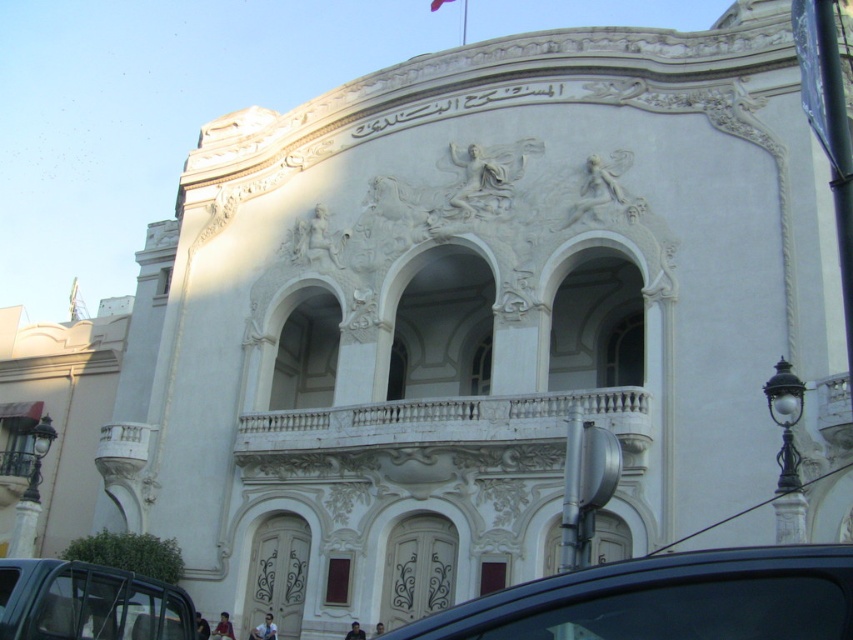
Question: Which point appears farthest from the camera in this image?

Choices:
 (A) (430, 3)
 (B) (527, 611)

Answer: (A)

Question: Which of the following is the closest to the observer?

Choices:
 (A) (430, 3)
 (B) (180, 618)

Answer: (B)

Question: Is the position of metallic gray car at lower left less distant than that of white fabric flag at upper center?

Choices:
 (A) yes
 (B) no

Answer: (A)

Question: Is black glossy car at lower center positioned in front of metallic gray car at lower left?

Choices:
 (A) no
 (B) yes

Answer: (B)

Question: Which object appears farthest from the camera in this image?

Choices:
 (A) black glossy car at lower center
 (B) white fabric flag at upper center

Answer: (B)

Question: Can you confirm if black glossy car at lower center is thinner than metallic gray car at lower left?

Choices:
 (A) yes
 (B) no

Answer: (B)